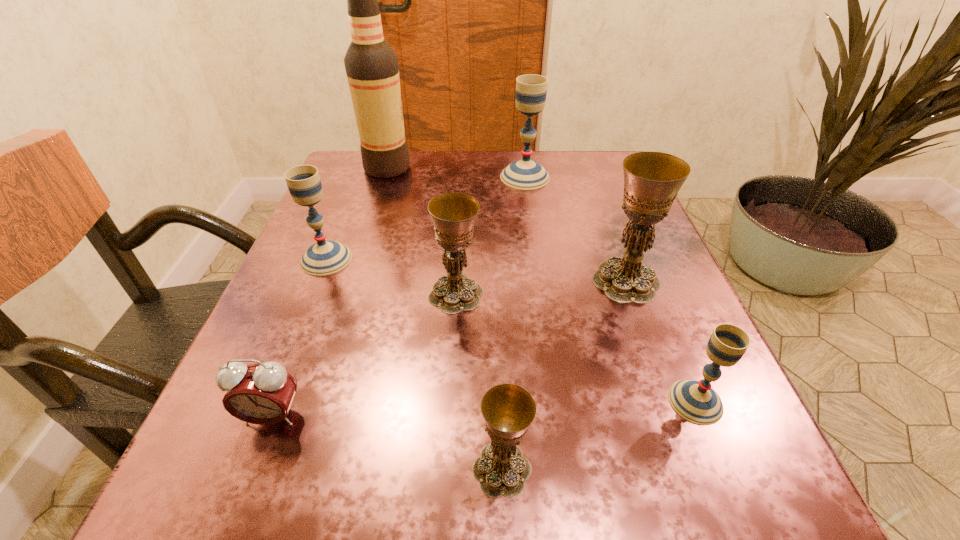
The height and width of the screenshot is (540, 960). Find the location of `the tallest object`. the tallest object is located at coordinates (372, 70).

What are the coordinates of `beige alcohol` in the screenshot? It's located at (372, 70).

At what (x,y) coordinates should I click in order to perform the action: click on the biggest gray chalice. Please return your answer as a coordinate pair (x, y). The height and width of the screenshot is (540, 960). Looking at the image, I should click on (531, 90).

Find the location of a particular element. the farthest chalice is located at coordinates (531, 90).

Where is `the biggest gold chalice`? The height and width of the screenshot is (540, 960). the biggest gold chalice is located at coordinates (652, 180).

Where is `the second biggest gold chalice`? The height and width of the screenshot is (540, 960). the second biggest gold chalice is located at coordinates (453, 214).

At what (x,y) coordinates should I click in order to perform the action: click on the second smallest gray chalice. Please return your answer as a coordinate pair (x, y). Looking at the image, I should click on 325,257.

Locate an element on the screen. This screenshot has height=540, width=960. the second nearest gray chalice is located at coordinates (325, 257).

This screenshot has width=960, height=540. What are the coordinates of `the nearest gray chalice` in the screenshot? It's located at (695, 401).

I want to click on the rightmost gray chalice, so click(695, 401).